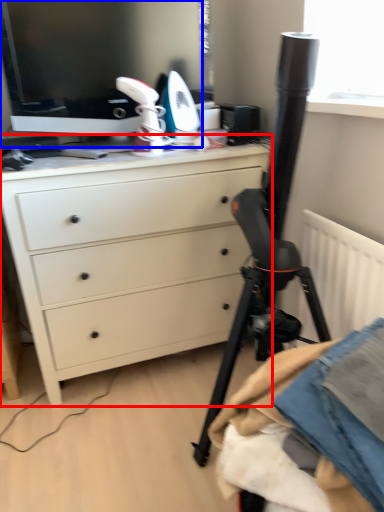
Question: Which object appears closest to the camera in this image, chest of drawers (highlighted by a red box) or computer monitor (highlighted by a blue box)?

Choices:
 (A) chest of drawers
 (B) computer monitor

Answer: (A)